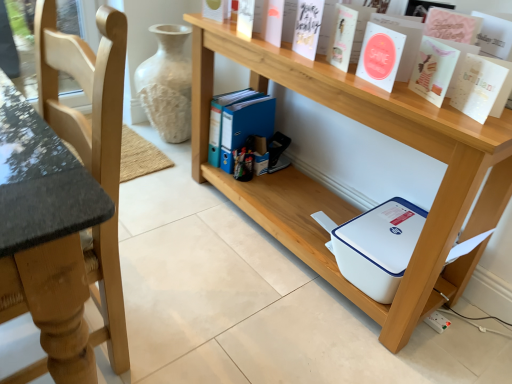
What do you see at coordinates (91, 147) in the screenshot? The width and height of the screenshot is (512, 384). I see `light wood chair at left` at bounding box center [91, 147].

Where is `white matte paper at upper center, the fourth paperback book viewed from the right`? The width and height of the screenshot is (512, 384). white matte paper at upper center, the fourth paperback book viewed from the right is located at coordinates (342, 37).

This screenshot has width=512, height=384. What are the coordinates of `white paper at upper center, the 3th paperback book positioned from the right` in the screenshot? It's located at (381, 55).

In order to face white plastic printer at lower center, should I rotate leftwards or rightwards?

Turn right by 8.844 degrees to look at white plastic printer at lower center.

At what (x,y) coordinates should I click in order to perform the action: click on light wood chair at left. Please return your answer as a coordinate pair (x, y). The width and height of the screenshot is (512, 384). Looking at the image, I should click on (91, 147).

Does point (368, 49) lie in front of point (211, 88)?

Yes, point (368, 49) is closer to viewer.

You are a GUI agent. You are given a task and a screenshot of the screen. Output one action in this format:
    pyautogui.click(x=<x>, y=<y>)
    Task: Click on the shelf in front of the white paper at upper center, positioned as the 3th paperback book in left-to-right order
    The height and width of the screenshot is (384, 512).
    Given the screenshot: What is the action you would take?
    pyautogui.click(x=346, y=201)

Between white paper at upper center, positioned as the 3th paperback book in left-to-right order, and white plastic printer at lower center, which one has smaller size?

With smaller size is white paper at upper center, positioned as the 3th paperback book in left-to-right order.

Considering the positions of objects white paper at upper center, the 3th paperback book positioned from the right, and white plastic printer at lower center in the image provided, who is more to the right, white paper at upper center, the 3th paperback book positioned from the right, or white plastic printer at lower center?

Positioned to the right is white paper at upper center, the 3th paperback book positioned from the right.

Is point (115, 202) closer to viewer compared to point (439, 76)?

Yes, it is.

How different are the orientations of light wood chair at left and matte pink card at upper right, arranged as the 2th paperback book when viewed from the right, in degrees?

21.3 degrees.

Is light wood chair at left facing towards matte pink card at upper right, which is counted as the 4th paperback book, starting from the left?

No, light wood chair at left is not aimed at matte pink card at upper right, which is counted as the 4th paperback book, starting from the left.

Which is in front, point (344, 30) or point (149, 64)?

Positioned in front is point (344, 30).

Which object is further away from the camera taking this photo, white matte paper at upper center, which ranks as the second paperback book in left-to-right order, or white matte vase at center?

Positioned behind is white matte vase at center.

Consider the image. Would you say white matte paper at upper center, the fourth paperback book viewed from the right, contains white matte vase at center?

That's incorrect, white matte vase at center is not inside white matte paper at upper center, the fourth paperback book viewed from the right.

Is white matte paper at upper center, the fourth paperback book viewed from the right, far from white matte vase at center?

Yes, white matte paper at upper center, the fourth paperback book viewed from the right, and white matte vase at center are quite far apart.

Who is more distant, matte pink card at upper right, arranged as the 2th paperback book when viewed from the right, or white matte vase at center?

white matte vase at center is further away from the camera.

How many degrees apart are the facing directions of matte pink card at upper right, arranged as the 2th paperback book when viewed from the right, and white matte vase at center?

There is a 21.6-degree angle between the facing directions of matte pink card at upper right, arranged as the 2th paperback book when viewed from the right, and white matte vase at center.

Would you say matte pink card at upper right, arranged as the 2th paperback book when viewed from the right, contains white matte vase at center?

No, white matte vase at center is not surrounded by matte pink card at upper right, arranged as the 2th paperback book when viewed from the right.

Which object is thinner, matte pink card at upper right, arranged as the 2th paperback book when viewed from the right, or white matte vase at center?

With smaller width is matte pink card at upper right, arranged as the 2th paperback book when viewed from the right.

From a real-world perspective, is white matte paper at upper center, which ranks as the fifth paperback book in right-to-left order, above or below white plastic printer at lower center?

white matte paper at upper center, which ranks as the fifth paperback book in right-to-left order, is situated higher than white plastic printer at lower center in the real world.

Choose the correct answer: Is white matte paper at upper center, which ranks as the fifth paperback book in right-to-left order, inside white plastic printer at lower center or outside it?

white matte paper at upper center, which ranks as the fifth paperback book in right-to-left order, lies outside white plastic printer at lower center.

From the image's perspective, relative to white plastic printer at lower center, is white matte paper at upper center, which is counted as the first paperback book, starting from the left, above or below?

Clearly, from the image's perspective, white matte paper at upper center, which is counted as the first paperback book, starting from the left, is above white plastic printer at lower center.

Is there a large distance between white matte paper at upper center, which ranks as the fifth paperback book in right-to-left order, and white plastic printer at lower center?

No, white matte paper at upper center, which ranks as the fifth paperback book in right-to-left order, is in close proximity to white plastic printer at lower center.

Which is correct: white plastic printer at lower center is inside matte pink card at upper right, arranged as the 2th paperback book when viewed from the right, or outside of it?

white plastic printer at lower center lies outside matte pink card at upper right, arranged as the 2th paperback book when viewed from the right.

How many degrees apart are the facing directions of white plastic printer at lower center and matte pink card at upper right, which is counted as the 4th paperback book, starting from the left?

There is a 22.3-degree angle between the facing directions of white plastic printer at lower center and matte pink card at upper right, which is counted as the 4th paperback book, starting from the left.

Is white plastic printer at lower center oriented away from matte pink card at upper right, arranged as the 2th paperback book when viewed from the right?

No, white plastic printer at lower center is not facing away from matte pink card at upper right, arranged as the 2th paperback book when viewed from the right.

Is white plastic printer at lower center wider or thinner than matte pink card at upper right, arranged as the 2th paperback book when viewed from the right?

white plastic printer at lower center is wider than matte pink card at upper right, arranged as the 2th paperback book when viewed from the right.

Is white paper at upper center, the 3th paperback book positioned from the right, oriented towards white matte vase at center?

No, white paper at upper center, the 3th paperback book positioned from the right, is not turned towards white matte vase at center.

Looking at the image, does white paper at upper center, positioned as the 3th paperback book in left-to-right order, seem bigger or smaller compared to white matte vase at center?

white paper at upper center, positioned as the 3th paperback book in left-to-right order, is smaller than white matte vase at center.

Considering the positions of points (398, 37) and (179, 38), is point (398, 37) farther from camera compared to point (179, 38)?

No, it is in front of (179, 38).

Where is `shelf lying on the left of white paper at upper center, positioned as the 3th paperback book in left-to-right order`? The image size is (512, 384). shelf lying on the left of white paper at upper center, positioned as the 3th paperback book in left-to-right order is located at coordinates (346, 201).

Find the location of `the 2nd paperback book behind the light wood chair at left`. the 2nd paperback book behind the light wood chair at left is located at coordinates (434, 70).

Estimate the real-world distances between objects in this image. Which object is closer to white matte paper at upper center, which is counted as the first paperback book, starting from the left, white matte vase at center or light wood chair at left?

light wood chair at left.

When comparing their distances from white plastic printer at lower center, does white paper at upper right, which ranks as the first paperback book in right-to-left order, or white matte paper at upper center, which ranks as the fifth paperback book in right-to-left order, seem closer?

white paper at upper right, which ranks as the first paperback book in right-to-left order.

When comparing their distances from white matte paper at upper center, the fourth paperback book viewed from the right, does white paper at upper right, acting as the fifth paperback book starting from the left, or white matte vase at center seem further?

white matte vase at center lies further to white matte paper at upper center, the fourth paperback book viewed from the right, than the other object.

Which object lies further to the anchor point matte pink card at upper right, arranged as the 2th paperback book when viewed from the right, white paper at upper center, positioned as the 3th paperback book in left-to-right order, or light wood chair at left?

The object further to matte pink card at upper right, arranged as the 2th paperback book when viewed from the right, is light wood chair at left.

Consider the image. Looking at the image, which one is located closer to white plastic printer at lower center, white paper at upper right, acting as the fifth paperback book starting from the left, or white matte paper at upper center, which ranks as the second paperback book in left-to-right order?

Based on the image, white paper at upper right, acting as the fifth paperback book starting from the left, appears to be nearer to white plastic printer at lower center.

When comparing their distances from white paper at upper center, positioned as the 3th paperback book in left-to-right order, does white plastic printer at lower center or white matte paper at upper center, which is counted as the first paperback book, starting from the left, seem closer?

white matte paper at upper center, which is counted as the first paperback book, starting from the left, lies closer to white paper at upper center, positioned as the 3th paperback book in left-to-right order, than the other object.

Estimate the real-world distances between objects in this image. Which object is further from white paper at upper right, which ranks as the first paperback book in right-to-left order, light wood chair at left or white matte vase at center?

Based on the image, white matte vase at center appears to be further to white paper at upper right, which ranks as the first paperback book in right-to-left order.

Considering their positions, is white matte paper at upper center, which ranks as the second paperback book in left-to-right order, positioned closer to white matte vase at center than light wood chair at left?

The object closer to white matte vase at center is white matte paper at upper center, which ranks as the second paperback book in left-to-right order.

What are the coordinates of `shelf between light wood chair at left and matte pink card at upper right, arranged as the 2th paperback book when viewed from the right, from left to right` in the screenshot? It's located at (346, 201).

Find the location of a particular element. Image resolution: width=512 pixels, height=384 pixels. shelf between light wood chair at left and white paper at upper right, which ranks as the first paperback book in right-to-left order is located at coordinates (346, 201).

Locate an element on the screen. The width and height of the screenshot is (512, 384). paperback book situated between white matte paper at upper center, which ranks as the second paperback book in left-to-right order, and matte pink card at upper right, arranged as the 2th paperback book when viewed from the right, from left to right is located at coordinates (381, 55).

Locate an element on the screen. paperback book between white matte paper at upper center, which ranks as the second paperback book in left-to-right order, and white matte vase at center, along the z-axis is located at coordinates (308, 27).